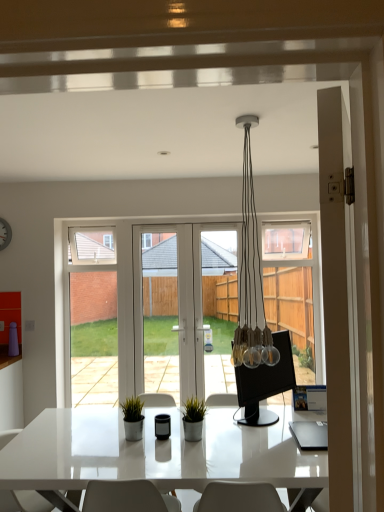
Question: Are black glossy monitor at center and clear glass door at center, marked as the 2th screen door in a left-to-right arrangement, far apart?

Choices:
 (A) yes
 (B) no

Answer: (A)

Question: Is black glossy monitor at center touching clear glass door at center, the second screen door in the right-to-left sequence?

Choices:
 (A) yes
 (B) no

Answer: (B)

Question: Does black glossy monitor at center have a smaller size compared to clear glass door at center, marked as the 2th screen door in a left-to-right arrangement?

Choices:
 (A) no
 (B) yes

Answer: (B)

Question: Can you confirm if black glossy monitor at center is positioned to the left of clear glass door at center, marked as the 2th screen door in a left-to-right arrangement?

Choices:
 (A) yes
 (B) no

Answer: (B)

Question: From the image's perspective, is black glossy monitor at center located beneath clear glass door at center, the second screen door in the right-to-left sequence?

Choices:
 (A) yes
 (B) no

Answer: (A)

Question: Could you tell me if black glossy monitor at center is facing clear glass door at center, the second screen door in the right-to-left sequence?

Choices:
 (A) yes
 (B) no

Answer: (B)

Question: Is green matte plant at center oriented towards white glossy chair at lower left?

Choices:
 (A) no
 (B) yes

Answer: (A)

Question: Is green matte plant at center not inside white glossy chair at lower left?

Choices:
 (A) no
 (B) yes

Answer: (B)

Question: Does green matte plant at center lie in front of white glossy chair at lower left?

Choices:
 (A) yes
 (B) no

Answer: (B)

Question: Is green matte plant at center taller than white glossy chair at lower left?

Choices:
 (A) no
 (B) yes

Answer: (A)

Question: From the image's perspective, does green matte plant at center appear higher than white glossy chair at lower left?

Choices:
 (A) no
 (B) yes

Answer: (B)

Question: From the image's perspective, is green matte plant at center under white glossy chair at lower left?

Choices:
 (A) no
 (B) yes

Answer: (A)

Question: Considering the relative positions of green matte plant at center and white glossy screen door at center, positioned as the 3th screen door in left-to-right order, in the image provided, is green matte plant at center to the left of white glossy screen door at center, positioned as the 3th screen door in left-to-right order, from the viewer's perspective?

Choices:
 (A) yes
 (B) no

Answer: (A)